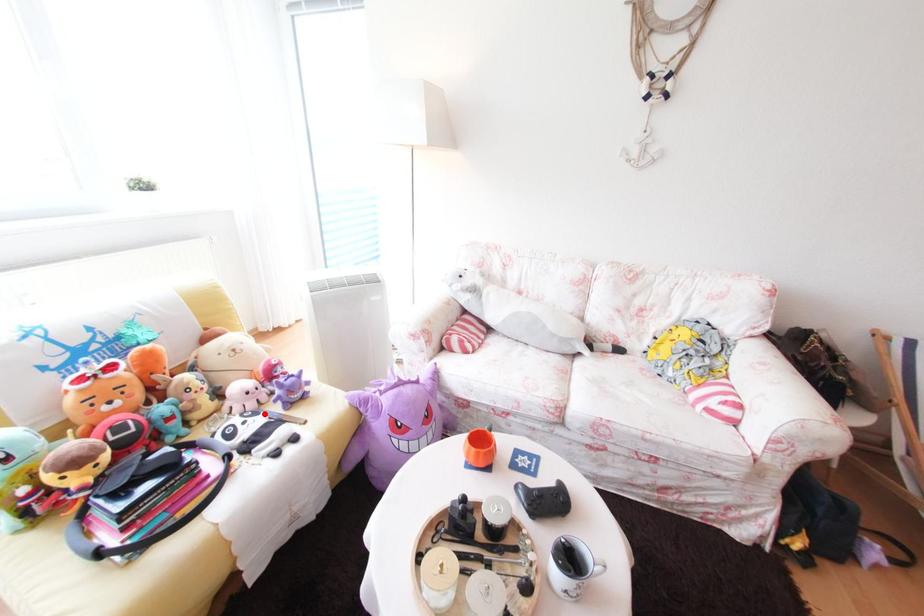
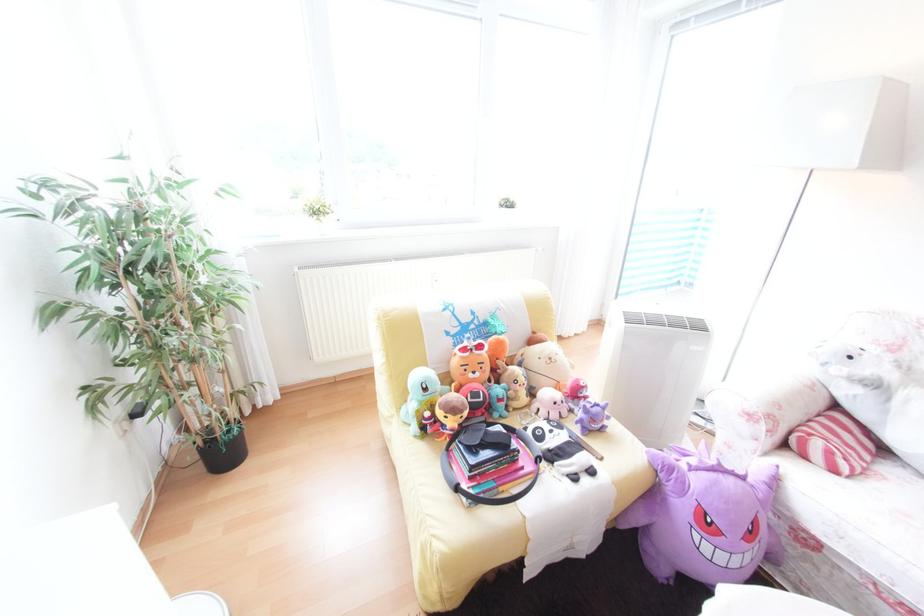
Locate, in the second image, the point that corresponds to the highlighted location in the first image.

(568, 427)